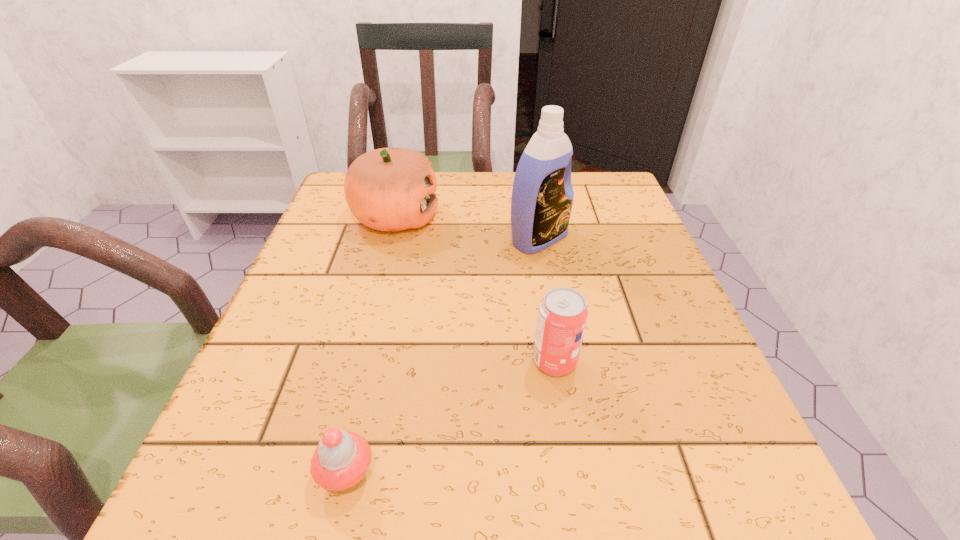
You are a GUI agent. You are given a task and a screenshot of the screen. Output one action in this format:
    pyautogui.click(x=<x>, y=<y>)
    Task: Click on the unoccupied area between the pumpkin and the nearest object
    
    Given the screenshot: What is the action you would take?
    pyautogui.click(x=372, y=346)

Identify the location of vacant point located between the detergent and the pumpkin. Image resolution: width=960 pixels, height=540 pixels. (468, 228).

Image resolution: width=960 pixels, height=540 pixels. In order to click on unoccupied area between the tallest object and the third shortest object in this screenshot , I will do `click(468, 228)`.

Identify the location of free space that is in between the nearest object and the third tallest object. (451, 418).

In order to click on object that can be found as the third closest to the soda can in this screenshot , I will do (x=389, y=189).

Locate which object is the closest to the soda can. Please provide its 2D coordinates. Your answer should be formatted as a tuple, i.e. [(x, y)], where the tuple contains the x and y coordinates of a point satisfying the conditions above.

[(542, 197)]

Find the location of a particular element. Image resolution: width=960 pixels, height=540 pixels. vacant space that satisfies the following two spatial constraints: 1. on the back side of the tallest object; 2. on the left side of the soda can is located at coordinates (535, 239).

Where is `free spot that satisfies the following two spatial constraints: 1. on the back side of the cupcake; 2. on the face of the second tallest object`? free spot that satisfies the following two spatial constraints: 1. on the back side of the cupcake; 2. on the face of the second tallest object is located at coordinates (406, 217).

Find the location of a particular element. The width and height of the screenshot is (960, 540). free space that satisfies the following two spatial constraints: 1. on the back side of the shortest object; 2. on the right side of the detergent is located at coordinates (400, 239).

Identify the location of free space that satisfies the following two spatial constraints: 1. on the face of the pumpkin; 2. on the left side of the detergent. (390, 239).